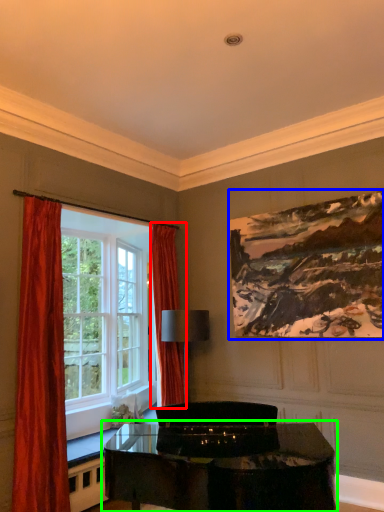
Question: Based on their relative distances, which object is farther from curtain (highlighted by a red box)? Choose from picture frame (highlighted by a blue box) and table (highlighted by a green box).

Choices:
 (A) picture frame
 (B) table

Answer: (B)